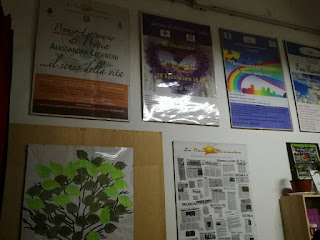
Locate an element on the screen. This screenshot has height=240, width=320. picture on shelf is located at coordinates (308, 159).